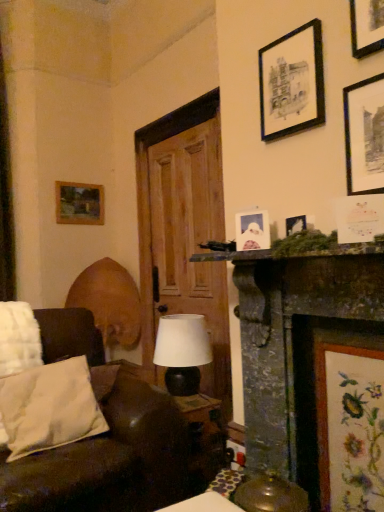
What do you see at coordinates (350, 426) in the screenshot? I see `embroidered fabric at lower right, the 6th picture frame when ordered from top to bottom` at bounding box center [350, 426].

Image resolution: width=384 pixels, height=512 pixels. Identify the location of matte white paper at upper right, which is counted as the second picture frame, starting from the right. (359, 218).

Identify the location of black matte picture frame at upper right, the fourth picture frame when ordered from back to front. This screenshot has height=512, width=384. (364, 135).

Find the location of a particular element. Image resolution: width=384 pixels, height=512 pixels. white paper picture frame at upper center, the fifth picture frame when ordered from top to bottom is located at coordinates (252, 230).

Based on the photo, what is the approximate width of brown leather couch at lower left?

brown leather couch at lower left is 1.06 meters wide.

What is the approximate height of matte black lamp at center?

It is 42.04 centimeters.

This screenshot has width=384, height=512. Find the location of `dark gray stone fireplace at center right`. dark gray stone fireplace at center right is located at coordinates (298, 345).

From a real-world perspective, who is located higher, black matte picture frame at upper right, which ranks as the sixth picture frame in bottom-to-top order, or dark gray stone fireplace at center right?

In real-world perspective, black matte picture frame at upper right, which ranks as the sixth picture frame in bottom-to-top order, is above.

Based on their sizes in the image, would you say black matte picture frame at upper right, marked as the second picture frame in a back-to-front arrangement, is bigger or smaller than dark gray stone fireplace at center right?

black matte picture frame at upper right, marked as the second picture frame in a back-to-front arrangement, is smaller than dark gray stone fireplace at center right.

Does black matte picture frame at upper right, which ranks as the sixth picture frame in bottom-to-top order, touch dark gray stone fireplace at center right?

No, black matte picture frame at upper right, which ranks as the sixth picture frame in bottom-to-top order, is not in contact with dark gray stone fireplace at center right.

Considering the sizes of objects black matte picture frame at upper right, which is the fourth picture frame from right to left, and dark gray stone fireplace at center right in the image provided, who is shorter, black matte picture frame at upper right, which is the fourth picture frame from right to left, or dark gray stone fireplace at center right?

black matte picture frame at upper right, which is the fourth picture frame from right to left, is shorter.

Is black matte picture frame at upper right, arranged as the 3th picture frame when viewed from the left, a part of matte white paper at upper right, which is counted as the second picture frame, starting from the right?

Actually, black matte picture frame at upper right, arranged as the 3th picture frame when viewed from the left, is outside matte white paper at upper right, which is counted as the second picture frame, starting from the right.

Is matte white paper at upper right, the 4th picture frame from the top, oriented away from black matte picture frame at upper right, which ranks as the sixth picture frame in bottom-to-top order?

matte white paper at upper right, the 4th picture frame from the top, is not turned away from black matte picture frame at upper right, which ranks as the sixth picture frame in bottom-to-top order.

Which is more to the right, matte white paper at upper right, which is counted as the 6th picture frame, starting from the back, or black matte picture frame at upper right, which is the fourth picture frame from right to left?

matte white paper at upper right, which is counted as the 6th picture frame, starting from the back.

Considering the sizes of objects black matte picture frame at upper right, the fifth picture frame when ordered from front to back, and black matte picture frame at upper right, positioned as the 1th picture frame in right-to-left order, in the image provided, who is thinner, black matte picture frame at upper right, the fifth picture frame when ordered from front to back, or black matte picture frame at upper right, positioned as the 1th picture frame in right-to-left order,?

black matte picture frame at upper right, positioned as the 1th picture frame in right-to-left order.

Identify the location of the 2nd picture frame directly above the black matte picture frame at upper right, the fourth picture frame when ordered from back to front (from a real-world perspective). This screenshot has width=384, height=512. (292, 82).

Consider the image. Is black matte picture frame at upper right, which is counted as the third picture frame, starting from the front, inside black matte picture frame at upper right, arranged as the 3th picture frame when viewed from the left?

No, black matte picture frame at upper right, arranged as the 3th picture frame when viewed from the left, does not contain black matte picture frame at upper right, which is counted as the third picture frame, starting from the front.

Does black matte picture frame at upper right, which ranks as the sixth picture frame in bottom-to-top order, turn towards black matte picture frame at upper right, positioned as the 1th picture frame in right-to-left order?

No, black matte picture frame at upper right, which ranks as the sixth picture frame in bottom-to-top order, is not facing towards black matte picture frame at upper right, positioned as the 1th picture frame in right-to-left order.

Considering the positions of objects black matte picture frame at upper right, marked as the second picture frame in a back-to-front arrangement, and matte white paper at upper right, which is counted as the 6th picture frame, starting from the back, in the image provided, who is behind, black matte picture frame at upper right, marked as the second picture frame in a back-to-front arrangement, or matte white paper at upper right, which is counted as the 6th picture frame, starting from the back,?

black matte picture frame at upper right, marked as the second picture frame in a back-to-front arrangement.

Considering the sizes of black matte picture frame at upper right, the fifth picture frame when ordered from front to back, and matte white paper at upper right, the 4th picture frame from the top, in the image, is black matte picture frame at upper right, the fifth picture frame when ordered from front to back, bigger or smaller than matte white paper at upper right, the 4th picture frame from the top,?

Clearly, black matte picture frame at upper right, the fifth picture frame when ordered from front to back, is larger in size than matte white paper at upper right, the 4th picture frame from the top.

Does point (285, 124) appear closer or farther from the camera than point (360, 240)?

Point (285, 124) is farther from the camera than point (360, 240).

From the image's perspective, is black matte picture frame at upper right, marked as the second picture frame in a back-to-front arrangement, over matte white paper at upper right, which appears as the third picture frame when ordered from the bottom?

Yes, from the image's perspective, black matte picture frame at upper right, marked as the second picture frame in a back-to-front arrangement, is over matte white paper at upper right, which appears as the third picture frame when ordered from the bottom.

Considering the sizes of white paper picture frame at upper center, the fourth picture frame positioned from the front, and dark gray stone fireplace at center right in the image, is white paper picture frame at upper center, the fourth picture frame positioned from the front, wider or thinner than dark gray stone fireplace at center right?

In the image, white paper picture frame at upper center, the fourth picture frame positioned from the front, appears to be more narrow than dark gray stone fireplace at center right.

In the scene shown: Is white paper picture frame at upper center, the fifth picture frame when ordered from top to bottom, aimed at dark gray stone fireplace at center right?

No, white paper picture frame at upper center, the fifth picture frame when ordered from top to bottom, is not oriented towards dark gray stone fireplace at center right.

Image resolution: width=384 pixels, height=512 pixels. In order to click on picture frame that is the 2nd object above the dark gray stone fireplace at center right (from a real-world perspective) in this screenshot , I will do `click(252, 230)`.

Which of these two, white paper picture frame at upper center, which is counted as the fifth picture frame, starting from the right, or dark gray stone fireplace at center right, stands shorter?

white paper picture frame at upper center, which is counted as the fifth picture frame, starting from the right.

Is brown leather couch at lower left inside the boundaries of matte white paper at upper right, positioned as the fifth picture frame in left-to-right order, or outside?

The correct answer is: outside.

Looking at this image, could you tell me if brown leather couch at lower left is turned towards matte white paper at upper right, positioned as the fifth picture frame in left-to-right order?

No, brown leather couch at lower left is not turned towards matte white paper at upper right, positioned as the fifth picture frame in left-to-right order.

Does point (87, 467) lie behind point (358, 209)?

Yes, it is.

From the image's perspective, relative to matte white paper at upper right, positioned as the fifth picture frame in left-to-right order, is brown leather couch at lower left above or below?

Based on their image positions, brown leather couch at lower left is located beneath matte white paper at upper right, positioned as the fifth picture frame in left-to-right order.

Is embroidered fabric at lower right, the 5th picture frame when ordered from back to front, spatially inside dark gray stone fireplace at center right, or outside of it?

embroidered fabric at lower right, the 5th picture frame when ordered from back to front, is contained in dark gray stone fireplace at center right.

Does embroidered fabric at lower right, the 6th picture frame when ordered from top to bottom, turn towards dark gray stone fireplace at center right?

Yes, embroidered fabric at lower right, the 6th picture frame when ordered from top to bottom, is turned towards dark gray stone fireplace at center right.

The image size is (384, 512). There is a dark gray stone fireplace at center right. In order to click on the 5th picture frame above it (from a real-world perspective) in this screenshot , I will do `click(292, 82)`.

Locate an element on the screen. the 4th picture frame behind the matte white paper at upper right, positioned as the fifth picture frame in left-to-right order, starting your count from the anchor is located at coordinates (292, 82).

Estimate the real-world distances between objects in this image. Which object is further from black matte picture frame at upper right, marked as the second picture frame in a back-to-front arrangement, white soft pillow at lower left or embroidered fabric at lower right, the 6th picture frame when ordered from top to bottom?

The object further to black matte picture frame at upper right, marked as the second picture frame in a back-to-front arrangement, is white soft pillow at lower left.

Considering their positions, is dark gray stone fireplace at center right positioned closer to white paper picture frame at upper center, arranged as the second picture frame when viewed from the left, than black matte picture frame at upper right, arranged as the 3th picture frame when viewed from the left?

Based on the image, dark gray stone fireplace at center right appears to be nearer to white paper picture frame at upper center, arranged as the second picture frame when viewed from the left.

Considering their positions, is white paper picture frame at upper center, the fifth picture frame when ordered from top to bottom, positioned closer to matte black lamp at center than black matte picture frame at upper right, which is counted as the third picture frame, starting from the front?

white paper picture frame at upper center, the fifth picture frame when ordered from top to bottom, is positioned closer to the anchor matte black lamp at center.

From the image, which object appears to be farther from dark gray stone fireplace at center right, brown leather couch at lower left or embroidered fabric at lower right, the fourth picture frame when ordered from left to right?

brown leather couch at lower left lies further to dark gray stone fireplace at center right than the other object.

Based on their spatial positions, is white paper picture frame at upper center, acting as the 3th picture frame starting from the back, or black matte picture frame at upper right, the fifth picture frame when ordered from front to back, closer to matte white paper at upper right, which is counted as the second picture frame, starting from the right?

The object closer to matte white paper at upper right, which is counted as the second picture frame, starting from the right, is white paper picture frame at upper center, acting as the 3th picture frame starting from the back.

When comparing their distances from matte white paper at upper right, which is counted as the 6th picture frame, starting from the back, does embroidered fabric at lower right, which is the second picture frame from front to back, or wooden picture frame at upper left, the 5th picture frame when ordered from bottom to top, seem closer?

embroidered fabric at lower right, which is the second picture frame from front to back, is positioned closer to the anchor matte white paper at upper right, which is counted as the 6th picture frame, starting from the back.

Considering their positions, is matte white paper at upper right, positioned as the fifth picture frame in left-to-right order, positioned further to matte black lamp at center than black matte picture frame at upper right, the fifth picture frame when ordered from front to back?

Based on the image, black matte picture frame at upper right, the fifth picture frame when ordered from front to back, appears to be further to matte black lamp at center.

Based on their spatial positions, is matte black lamp at center or matte white paper at upper right, the 4th picture frame from the top, closer to embroidered fabric at lower right, the 6th picture frame when ordered from top to bottom?

matte white paper at upper right, the 4th picture frame from the top, is closer to embroidered fabric at lower right, the 6th picture frame when ordered from top to bottom.

Locate an element on the screen. fireplace between black matte picture frame at upper right, marked as the second picture frame in a back-to-front arrangement, and white soft pillow at lower left from top to bottom is located at coordinates (298, 345).

You are a GUI agent. You are given a task and a screenshot of the screen. Output one action in this format:
    pyautogui.click(x=<x>, y=<y>)
    Task: Click on the table lamp located between white soft pillow at lower left and white paper picture frame at upper center, which is counted as the fifth picture frame, starting from the right, in the left-right direction
    Image resolution: width=384 pixels, height=512 pixels.
    Given the screenshot: What is the action you would take?
    (x=182, y=352)

The image size is (384, 512). Find the location of `pillow between dark gray stone fireplace at center right and wooden picture frame at upper left, arranged as the first picture frame when viewed from the back, along the z-axis`. pillow between dark gray stone fireplace at center right and wooden picture frame at upper left, arranged as the first picture frame when viewed from the back, along the z-axis is located at coordinates (49, 407).

The width and height of the screenshot is (384, 512). Find the location of `picture frame between brown leather couch at lower left and dark gray stone fireplace at center right`. picture frame between brown leather couch at lower left and dark gray stone fireplace at center right is located at coordinates (252, 230).